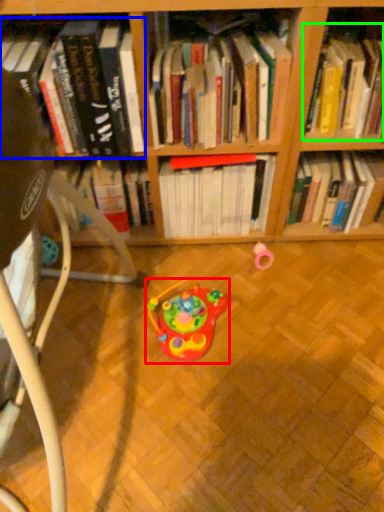
Question: Which object is positioned farthest from toy (highlighted by a red box)? Select from book (highlighted by a blue box) and book (highlighted by a green box).

Choices:
 (A) book
 (B) book

Answer: (B)